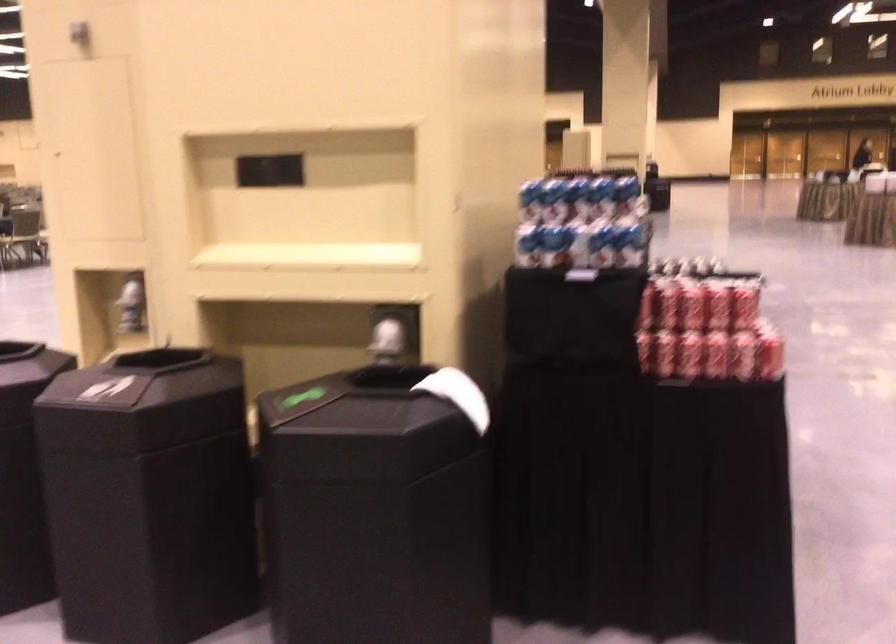
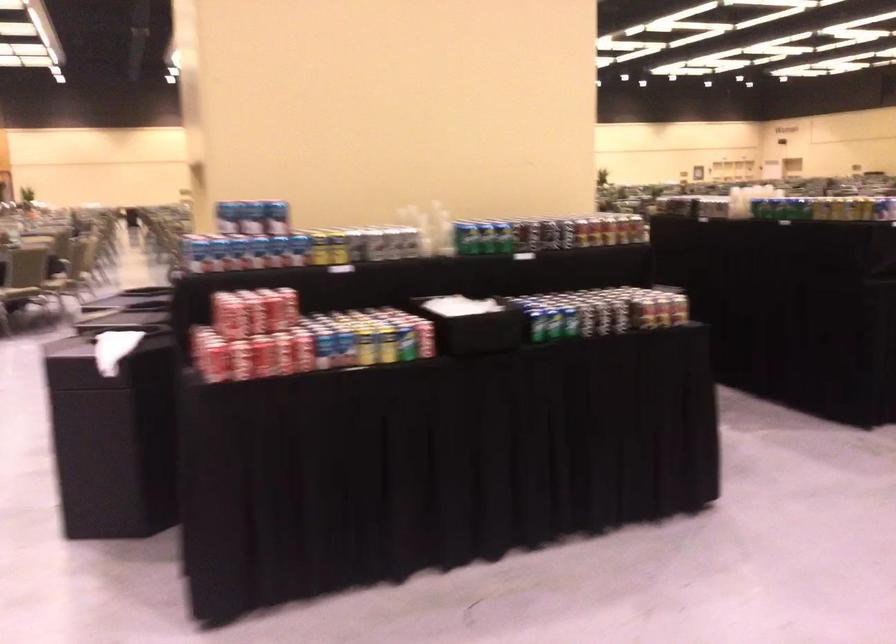
In the second image, find the point that corresponds to (x=757, y=303) in the first image.

(227, 315)